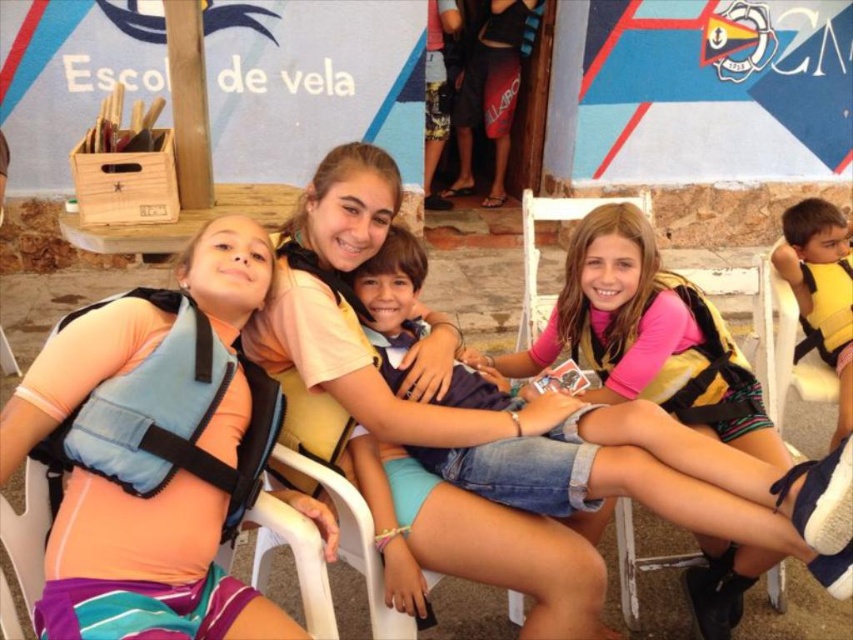
Does yellow life vest at center appear on the right side of yellow life vest at lower right?

Incorrect, yellow life vest at center is not on the right side of yellow life vest at lower right.

Between yellow life vest at center and yellow life vest at lower right, which one is positioned lower?

yellow life vest at center

Who is more distant from viewer, (596, 508) or (799, 259)?

Positioned behind is point (799, 259).

This screenshot has width=853, height=640. In order to click on yellow life vest at center in this screenshot , I will do `click(631, 477)`.